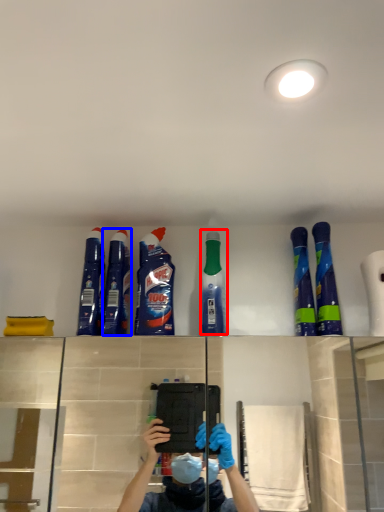
Question: Which of the following is the closest to the observer, cleaning product (highlighted by a red box) or cleaning product (highlighted by a blue box)?

Choices:
 (A) cleaning product
 (B) cleaning product

Answer: (A)